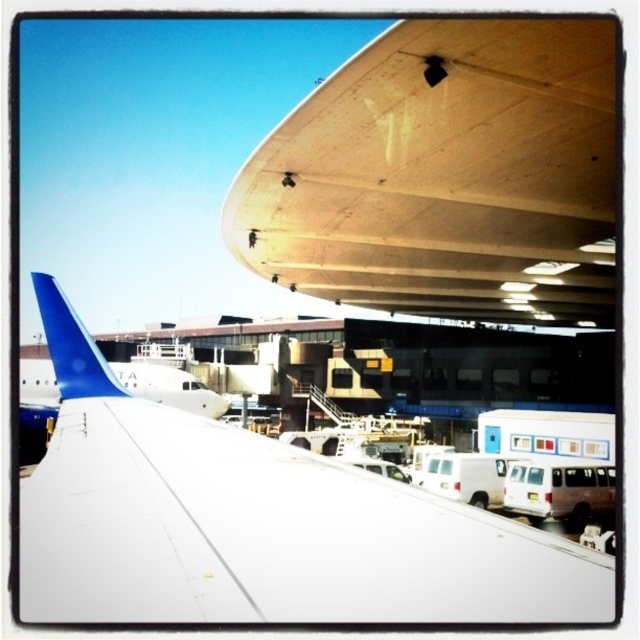
You are an airport maintenance worker checking the dimensions of the wooden airplane wing at upper center and the blue matte airplane tail at left. Which object is wider?

The wooden airplane wing at upper center is wider than the blue matte airplane tail at left.

You are a maintenance worker at the airport and need to inspect both the white matte wing at upper center and the blue matte airplane tail at left. Which object should you prioritize inspecting first if you want to start with the larger one?

The white matte wing at upper center is larger in size than the blue matte airplane tail at left, so you should prioritize inspecting the white matte wing at upper center first.

You are a maintenance worker at the airport and need to move a 15 meter long ladder between the wooden airplane wing at upper center and the white matte wing at upper center. Can you safely move the ladder horizontally between them without it touching either wing?

The wooden airplane wing at upper center and the white matte wing at upper center are 14.91 meters apart from each other. Since the ladder is 15 meters long, it would be too long to fit between them horizontally, so you cannot safely move the ladder without it touching either wing.